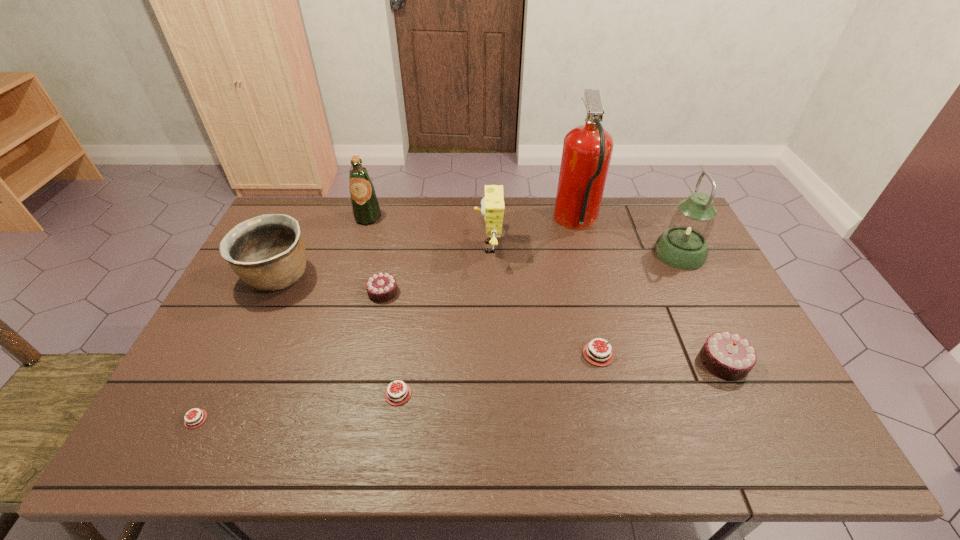
At what (x,y) coordinates should I click in order to perform the action: click on chocolate cake at the right edge. Please return your answer as a coordinate pair (x, y). Looking at the image, I should click on (727, 355).

This screenshot has height=540, width=960. What are the coordinates of `object located at the near left corner` in the screenshot? It's located at (188, 423).

Where is `object that is at the far right corner`? Image resolution: width=960 pixels, height=540 pixels. object that is at the far right corner is located at coordinates (683, 245).

In the image, there is a desktop. Where is `vacant space at the far edge`? vacant space at the far edge is located at coordinates (429, 227).

Identify the location of free space at the near edge of the desktop. This screenshot has height=540, width=960. (327, 446).

Locate an element on the screen. free space at the left edge of the desktop is located at coordinates (238, 289).

Locate an element on the screen. vacant space at the right edge of the desktop is located at coordinates (712, 286).

At what (x,y) coordinates should I click in order to perform the action: click on free space at the far right corner of the desktop. Please return your answer as a coordinate pair (x, y). The width and height of the screenshot is (960, 540). Looking at the image, I should click on (651, 205).

Identify the location of vacant space at the near right corner of the desktop. (740, 423).

Where is `vacant region between the fire extinguisher and the second red chocolate cake from left to right`? Image resolution: width=960 pixels, height=540 pixels. vacant region between the fire extinguisher and the second red chocolate cake from left to right is located at coordinates (488, 308).